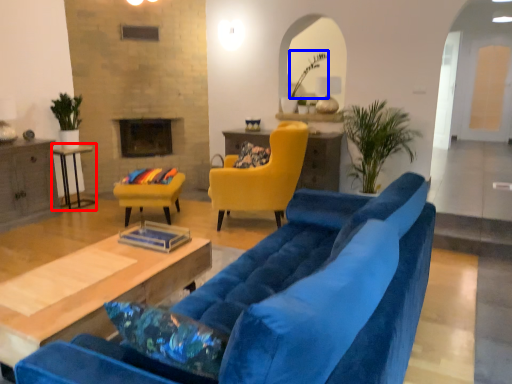
Question: Which object appears farthest to the camera in this image, table (highlighted by a red box) or plant (highlighted by a blue box)?

Choices:
 (A) table
 (B) plant

Answer: (B)